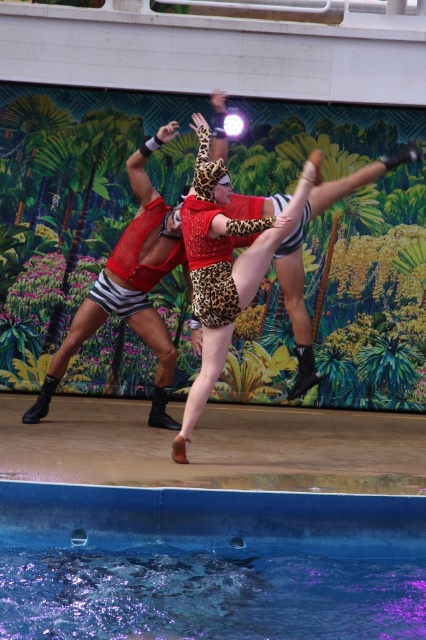
Does blue smooth water at lower center have a larger size compared to leopard print leotard at center?

Indeed, blue smooth water at lower center has a larger size compared to leopard print leotard at center.

Which is more to the left, blue smooth water at lower center or leopard print leotard at center?

From the viewer's perspective, leopard print leotard at center appears more on the left side.

Is point (420, 506) farther from viewer compared to point (203, 362)?

No, (420, 506) is closer to viewer.

You are a GUI agent. You are given a task and a screenshot of the screen. Output one action in this format:
    pyautogui.click(x=<x>, y=<y>)
    Task: Click on the blue smooth water at lower center
    The height and width of the screenshot is (640, 426).
    Given the screenshot: What is the action you would take?
    pyautogui.click(x=209, y=563)